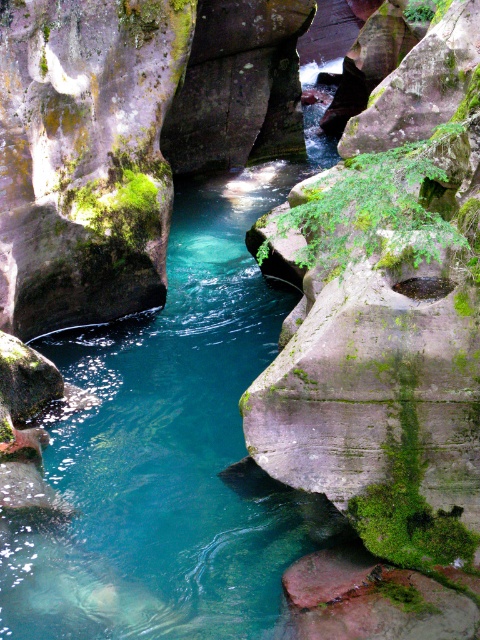
You are a hiker who wants to cross the river in the canyon. You see the clear water at center and the green mossy rock at left. Which object should you step on to safely cross the river?

You should step on the green mossy rock at left because it is positioned above the clear water at center, providing a stable surface to cross over the water safely.

You are a hiker who wants to cross the canyon using the river. You need to know which area is wider so you can plan your path. Which is wider, the clear water at center or the green mossy rock at left?

The clear water at center is bigger than the green mossy rock at left, so the clear water at center is wider and would be the better path for crossing.

You are standing at the edge of the canyon and see the point marked at coordinates point (168, 449). Based on the scene description, what type of surface is located at that point?

→ The point (168, 449) is on clear water at center.